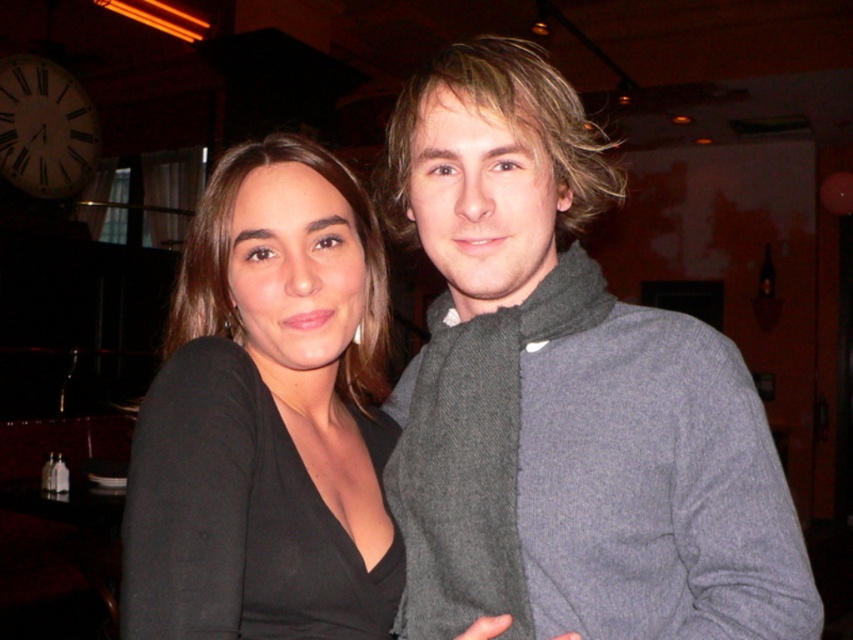
Where is `black matte shirt at center`? The image size is (853, 640). black matte shirt at center is located at coordinates pos(265,419).

Can you confirm if black matte shirt at center is positioned to the right of white wooden clock at upper left?

Yes, black matte shirt at center is to the right of white wooden clock at upper left.

This screenshot has height=640, width=853. Identify the location of black matte shirt at center. (265, 419).